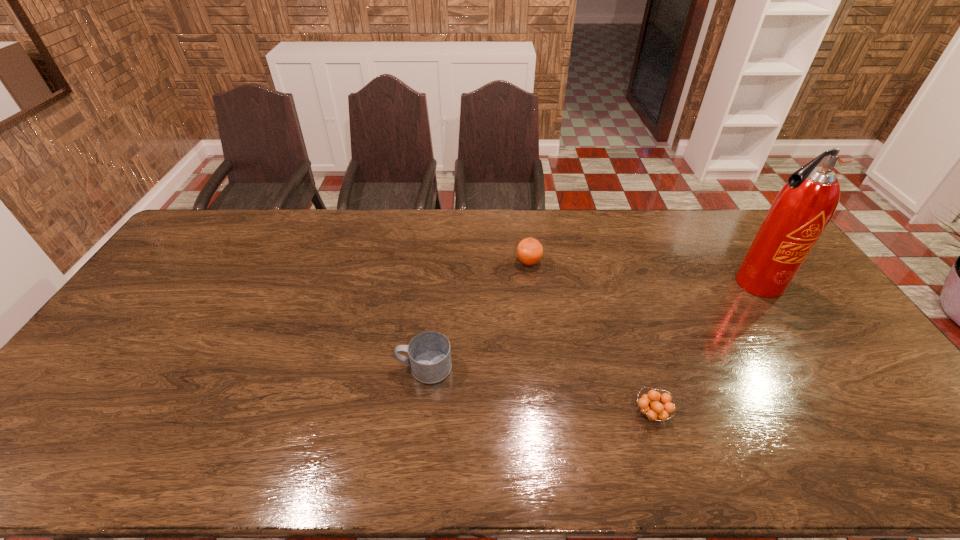
This screenshot has height=540, width=960. I want to click on free space that is in between the left orange fruit and the rightmost object, so click(x=642, y=273).

Identify the location of empty space between the shorter orange fruit and the third farthest object. The width and height of the screenshot is (960, 540). (538, 390).

Find the location of a particular element. Image resolution: width=960 pixels, height=540 pixels. free spot between the rightmost object and the shortest object is located at coordinates (704, 348).

This screenshot has height=540, width=960. What are the coordinates of `unoccupied position between the second object from right to left and the fire extinguisher` in the screenshot? It's located at (704, 348).

In order to click on free area in between the rightmost object and the leftmost object in this screenshot , I will do `click(590, 325)`.

Identify the location of free spot between the taller orange fruit and the leftmost object. The width and height of the screenshot is (960, 540). (476, 315).

You are a GUI agent. You are given a task and a screenshot of the screen. Output one action in this format:
    pyautogui.click(x=<x>, y=<y>)
    Task: Click on the vacant space that's between the tallest object and the left orange fruit
    The width and height of the screenshot is (960, 540).
    Given the screenshot: What is the action you would take?
    pyautogui.click(x=642, y=273)

Image resolution: width=960 pixels, height=540 pixels. Identify the location of free space between the shorter orange fruit and the taller orange fruit. (590, 338).

What are the coordinates of `vacant point located between the leftmost object and the left orange fruit` in the screenshot? It's located at (476, 315).

Where is `free space that is in between the mug and the rightmost object`? The height and width of the screenshot is (540, 960). free space that is in between the mug and the rightmost object is located at coordinates (590, 325).